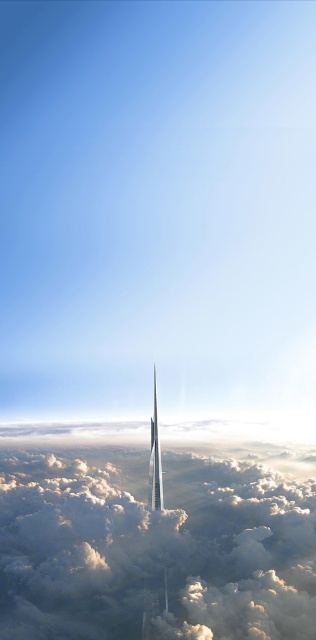
You are an astronaut floating in space and see the white fluffy cloud at center and the shiny silver rocket at center. Which object is located to the right side?

The shiny silver rocket at center is located to the right of the white fluffy cloud at center.

You are an astronaut preparing to launch a shiny silver rocket at center from the ground. There is a white fluffy cloud at center in the way. Can the rocket pass through the cloud without any issues?

The white fluffy cloud at center has a greater height compared to the shiny silver rocket at center. Therefore, the rocket may not be able to pass through the cloud without encountering resistance or obstruction due to the cloud being taller than the rocket.